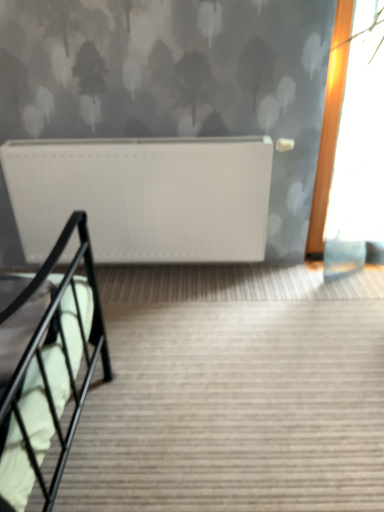
What is the approximate width of white matte radiator at upper center?

white matte radiator at upper center is 11.25 centimeters in width.

The height and width of the screenshot is (512, 384). Describe the element at coordinates (144, 196) in the screenshot. I see `white matte radiator at upper center` at that location.

Locate an element on the screen. The width and height of the screenshot is (384, 512). white matte radiator at upper center is located at coordinates (144, 196).

In order to face black metal stairs at lower left, should I rotate leftwards or rightwards?

To align with it, rotate right about 7.379°.

Describe the element at coordinates (235, 409) in the screenshot. This screenshot has width=384, height=512. I see `black metal stairs at lower left` at that location.

Locate an element on the screen. black metal stairs at lower left is located at coordinates (235, 409).

The width and height of the screenshot is (384, 512). In order to click on white matte radiator at upper center in this screenshot , I will do `click(144, 196)`.

Looking at this image, which is more to the right, white matte radiator at upper center or black metal stairs at lower left?

From the viewer's perspective, black metal stairs at lower left appears more on the right side.

Who is more distant, white matte radiator at upper center or black metal stairs at lower left?

white matte radiator at upper center is behind.

Between point (170, 247) and point (343, 344), which one is positioned in front?

The point (343, 344) is closer.

From the image's perspective, is white matte radiator at upper center located beneath black metal stairs at lower left?

Incorrect, from the image's perspective, white matte radiator at upper center is higher than black metal stairs at lower left.

From a real-world perspective, who is located lower, white matte radiator at upper center or black metal stairs at lower left?

black metal stairs at lower left, from a real-world perspective.

Does white matte radiator at upper center have a greater width compared to black metal stairs at lower left?

Incorrect, the width of white matte radiator at upper center does not surpass that of black metal stairs at lower left.

In terms of height, does white matte radiator at upper center look taller or shorter compared to black metal stairs at lower left?

In the image, white matte radiator at upper center appears to be taller than black metal stairs at lower left.

Is white matte radiator at upper center bigger or smaller than black metal stairs at lower left?

Clearly, white matte radiator at upper center is smaller in size than black metal stairs at lower left.

Is white matte radiator at upper center situated inside black metal stairs at lower left or outside?

The correct answer is: outside.

Is white matte radiator at upper center far away from black metal stairs at lower left?

white matte radiator at upper center is actually quite close to black metal stairs at lower left.

Could you tell me if white matte radiator at upper center is facing black metal stairs at lower left?

Yes, white matte radiator at upper center faces towards black metal stairs at lower left.

How many degrees apart are the facing directions of white matte radiator at upper center and black metal stairs at lower left?

They differ by 0.464 degrees in their facing directions.

This screenshot has width=384, height=512. I want to click on radiator lying above the black metal stairs at lower left (from the image's perspective), so click(x=144, y=196).

Which object is positioned more to the right, black metal stairs at lower left or white matte radiator at upper center?

From the viewer's perspective, black metal stairs at lower left appears more on the right side.

Is black metal stairs at lower left in front of or behind white matte radiator at upper center in the image?

In the image, black metal stairs at lower left appears in front of white matte radiator at upper center.

Between point (362, 320) and point (134, 229), which one is positioned behind?

The point (134, 229) is more distant.

From the image's perspective, is black metal stairs at lower left above or below white matte radiator at upper center?

Clearly, from the image's perspective, black metal stairs at lower left is below white matte radiator at upper center.

From a real-world perspective, is black metal stairs at lower left over white matte radiator at upper center?

Actually, black metal stairs at lower left is physically below white matte radiator at upper center in the real world.

Can you confirm if black metal stairs at lower left is thinner than white matte radiator at upper center?

No, black metal stairs at lower left is not thinner than white matte radiator at upper center.

Which of these two, black metal stairs at lower left or white matte radiator at upper center, stands shorter?

Standing shorter between the two is black metal stairs at lower left.

Between black metal stairs at lower left and white matte radiator at upper center, which one has smaller size?

white matte radiator at upper center is smaller.

Would you say black metal stairs at lower left is outside white matte radiator at upper center?

Absolutely, black metal stairs at lower left is external to white matte radiator at upper center.

Are black metal stairs at lower left and white matte radiator at upper center located far from each other?

No, black metal stairs at lower left is not far from white matte radiator at upper center.

Is black metal stairs at lower left looking in the opposite direction of white matte radiator at upper center?

No.

Find the location of a particular element. This screenshot has width=384, height=512. stairs in front of the white matte radiator at upper center is located at coordinates (235, 409).

This screenshot has height=512, width=384. Find the location of `stairs beneath the white matte radiator at upper center (from a real-world perspective)`. stairs beneath the white matte radiator at upper center (from a real-world perspective) is located at coordinates (235, 409).

The height and width of the screenshot is (512, 384). Find the location of `radiator located above the black metal stairs at lower left (from a real-world perspective)`. radiator located above the black metal stairs at lower left (from a real-world perspective) is located at coordinates (144, 196).